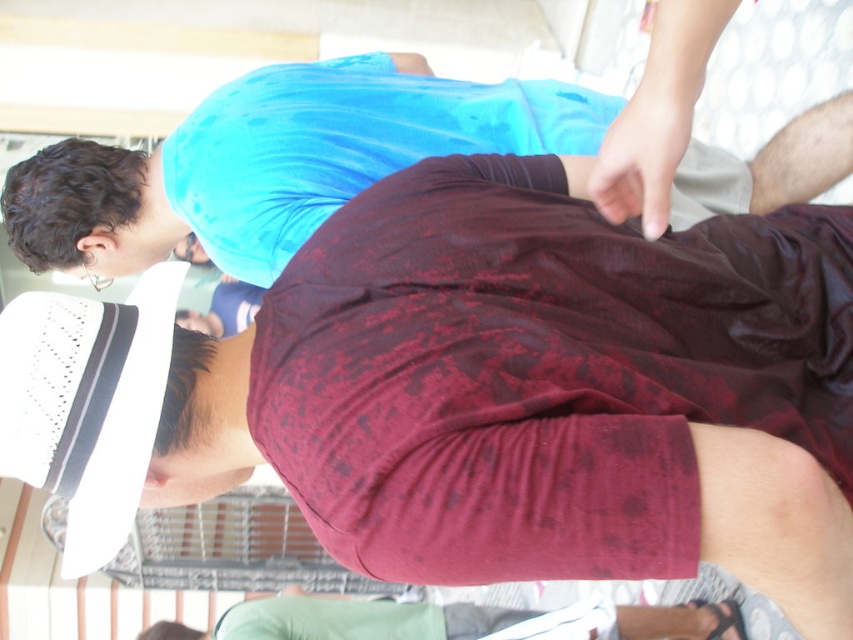
Which is in front, point (355, 620) or point (260, 288)?

Point (260, 288)

Does maroon fabric shirt at lower center have a lesser height compared to matte blue shirt at upper center?

Yes, maroon fabric shirt at lower center is shorter than matte blue shirt at upper center.

The height and width of the screenshot is (640, 853). In order to click on maroon fabric shirt at lower center in this screenshot , I will do pos(473,620).

Does maroon textured shirt at upper center lie behind maroon fabric shirt at lower center?

No, maroon textured shirt at upper center is closer to the viewer.

From the picture: Does maroon textured shirt at upper center appear under maroon fabric shirt at lower center?

No.

Which is behind, point (292, 189) or point (322, 628)?

The point (322, 628) is behind.

You are a GUI agent. You are given a task and a screenshot of the screen. Output one action in this format:
    pyautogui.click(x=<x>, y=<y>)
    Task: Click on the maroon textured shirt at upper center
    
    Given the screenshot: What is the action you would take?
    pyautogui.click(x=276, y=163)

Can you confirm if maroon textured shirt at upper center is wider than matte blue shirt at upper center?

Correct, the width of maroon textured shirt at upper center exceeds that of matte blue shirt at upper center.

Who is lower down, maroon textured shirt at upper center or matte blue shirt at upper center?

matte blue shirt at upper center is lower down.

Between point (239, 260) and point (177, 320), which one is positioned in front?

Point (239, 260) is in front.

Locate an element on the screen. The width and height of the screenshot is (853, 640). maroon textured shirt at upper center is located at coordinates (276, 163).